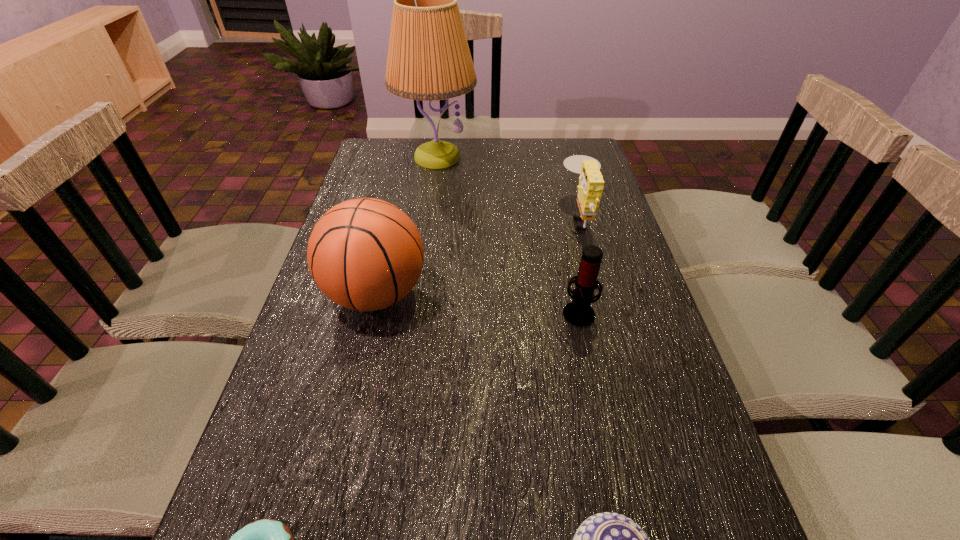
Locate an element on the screen. This screenshot has height=540, width=960. vacant point located 0.220m on the front-facing side of the fifth nearest object is located at coordinates (489, 216).

Locate an element on the screen. object situated at the far edge is located at coordinates (429, 59).

Identify the location of lamp at the left edge. The height and width of the screenshot is (540, 960). (429, 59).

Where is `basketball that is positioned at the left edge`? The width and height of the screenshot is (960, 540). basketball that is positioned at the left edge is located at coordinates (365, 254).

Where is `microphone situated at the right edge`? The width and height of the screenshot is (960, 540). microphone situated at the right edge is located at coordinates pos(579,313).

This screenshot has width=960, height=540. What are the coordinates of `sponge that is at the right edge` in the screenshot? It's located at point(591,182).

Where is `object located at the far left corner`? The width and height of the screenshot is (960, 540). object located at the far left corner is located at coordinates (429, 59).

The height and width of the screenshot is (540, 960). In the image, there is a desktop. Find the location of `blank space at the left edge`. blank space at the left edge is located at coordinates (363, 329).

Image resolution: width=960 pixels, height=540 pixels. What are the coordinates of `vacant space at the right edge of the desktop` in the screenshot? It's located at (597, 310).

Image resolution: width=960 pixels, height=540 pixels. What are the coordinates of `vacant position at the far left corner of the desktop` in the screenshot? It's located at (389, 154).